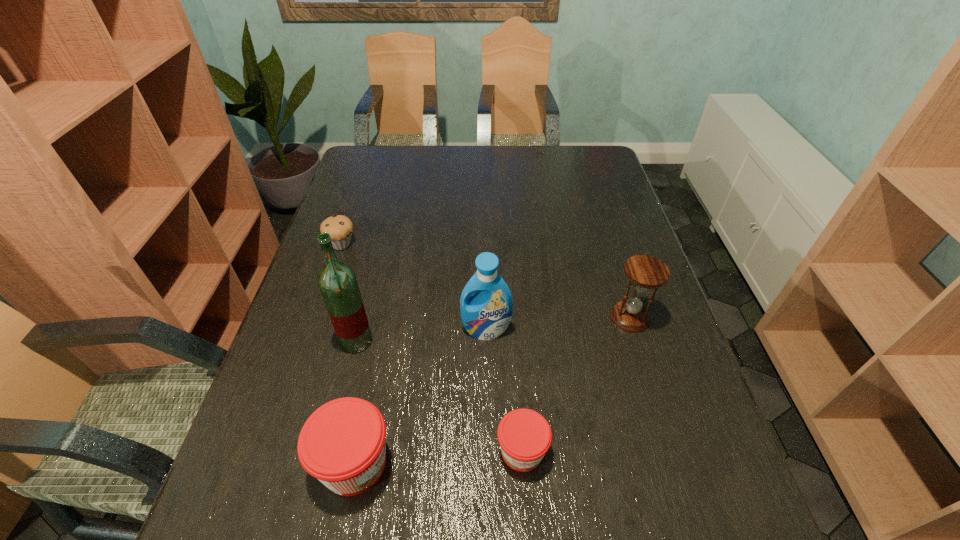
Where is `free spot located 0.050m on the front of the liquor`? free spot located 0.050m on the front of the liquor is located at coordinates (348, 373).

Identify the location of blank space located on the front of the muffin. The width and height of the screenshot is (960, 540). (330, 277).

The height and width of the screenshot is (540, 960). What are the coordinates of `free space located 0.100m on the front of the fourth shortest object` in the screenshot? It's located at (646, 369).

Identify the location of free spot located 0.090m on the front-facing side of the second tallest object. (487, 373).

This screenshot has width=960, height=540. What are the coordinates of `jam that is positioned at the left edge` in the screenshot? It's located at (342, 444).

Find the location of `liquor that is at the left edge`. liquor that is at the left edge is located at coordinates (337, 281).

Identify the location of muffin that is at the left edge. (340, 227).

This screenshot has width=960, height=540. In order to click on object located in the right edge section of the desktop in this screenshot , I will do `click(646, 272)`.

Find the location of a particular element. The height and width of the screenshot is (540, 960). object at the near left corner is located at coordinates (342, 444).

The image size is (960, 540). In the image, there is a desktop. In order to click on blank space at the far edge in this screenshot , I will do `click(460, 154)`.